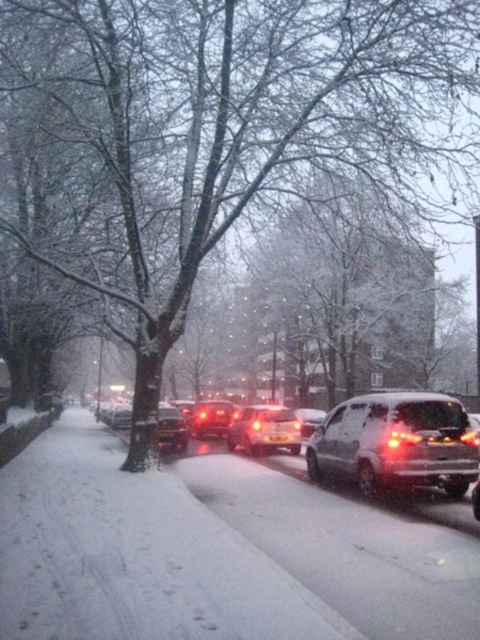
Can you confirm if shiny black sedan at center is bigger than sleek silver sedan at center?

No.

Where is `shiny black sedan at center`? shiny black sedan at center is located at coordinates (171, 428).

Where is `shiny black sedan at center`? The width and height of the screenshot is (480, 640). shiny black sedan at center is located at coordinates (171, 428).

How far apart are matte silver car at center and shiny black sedan at center?

matte silver car at center is 11.74 feet from shiny black sedan at center.

Measure the distance between matte silver car at center and camera.

They are 18.44 meters apart.

Image resolution: width=480 pixels, height=640 pixels. What do you see at coordinates (264, 429) in the screenshot? I see `matte silver car at center` at bounding box center [264, 429].

The width and height of the screenshot is (480, 640). I want to click on matte silver car at center, so click(x=264, y=429).

Can you confirm if matte red car at center is positioned below shiny black sedan at center?

Indeed, matte red car at center is positioned under shiny black sedan at center.

The image size is (480, 640). I want to click on matte red car at center, so click(211, 419).

Between point (204, 406) and point (179, 426), which one is positioned in front?

Point (179, 426) is more forward.

I want to click on matte red car at center, so click(211, 419).